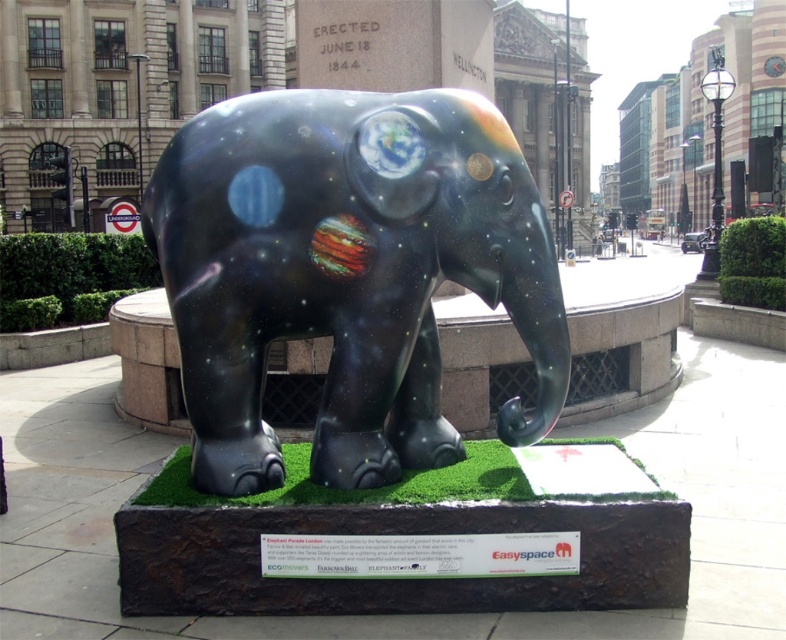
Question: Which point appears closest to the camera in this image?

Choices:
 (A) (237, 260)
 (B) (526, 486)

Answer: (A)

Question: Can you confirm if glossy metallic elephant at center is positioned to the right of green artificial turf at center?

Choices:
 (A) yes
 (B) no

Answer: (B)

Question: Is glossy metallic elephant at center smaller than green artificial turf at center?

Choices:
 (A) no
 (B) yes

Answer: (A)

Question: Which of the following is the closest to the observer?

Choices:
 (A) green artificial turf at center
 (B) glossy metallic elephant at center

Answer: (B)

Question: Is glossy metallic elephant at center below green artificial turf at center?

Choices:
 (A) no
 (B) yes

Answer: (A)

Question: Which point is farther from the camera taking this photo?

Choices:
 (A) (346, 168)
 (B) (465, 460)

Answer: (B)